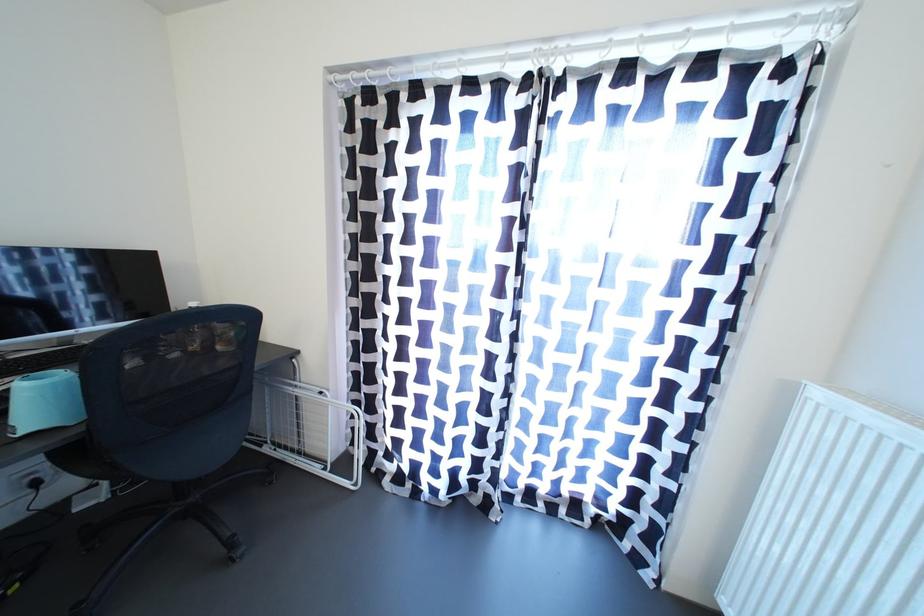
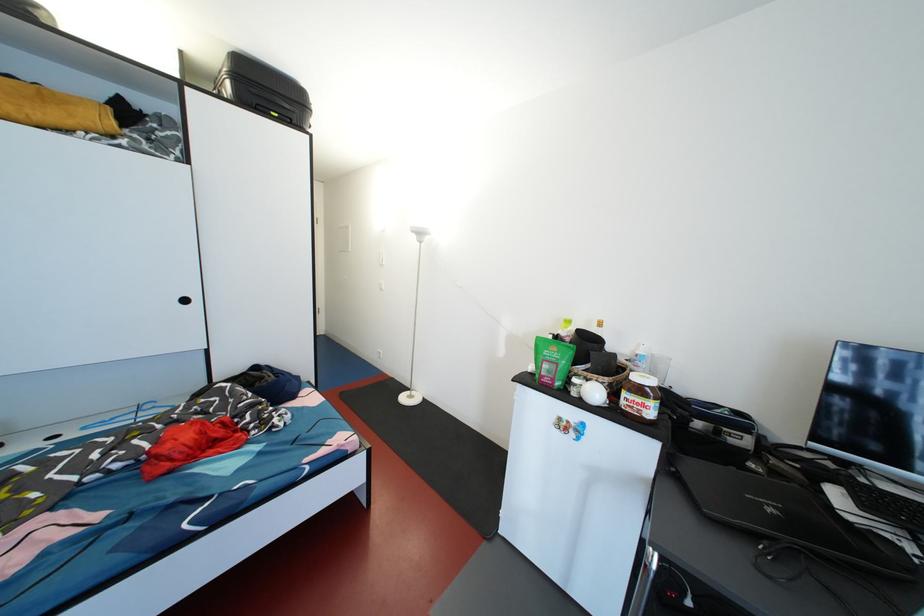
Question: The images are taken continuously from a first-person perspective. In which direction is your viewpoint rotating?

Choices:
 (A) Left
 (B) Right
 (C) Up
 (D) Down

Answer: (A)